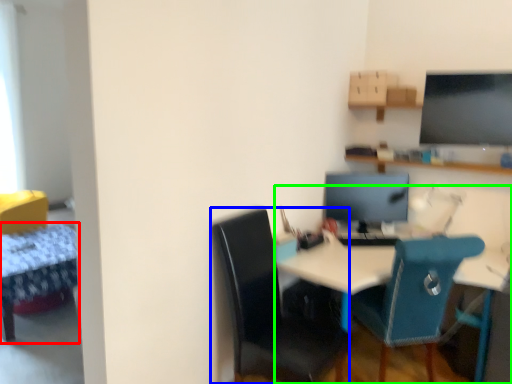
Question: Based on their relative distances, which object is farther from table (highlighted by a red box)? Choose from chair (highlighted by a blue box) and desk (highlighted by a green box).

Choices:
 (A) chair
 (B) desk

Answer: (B)